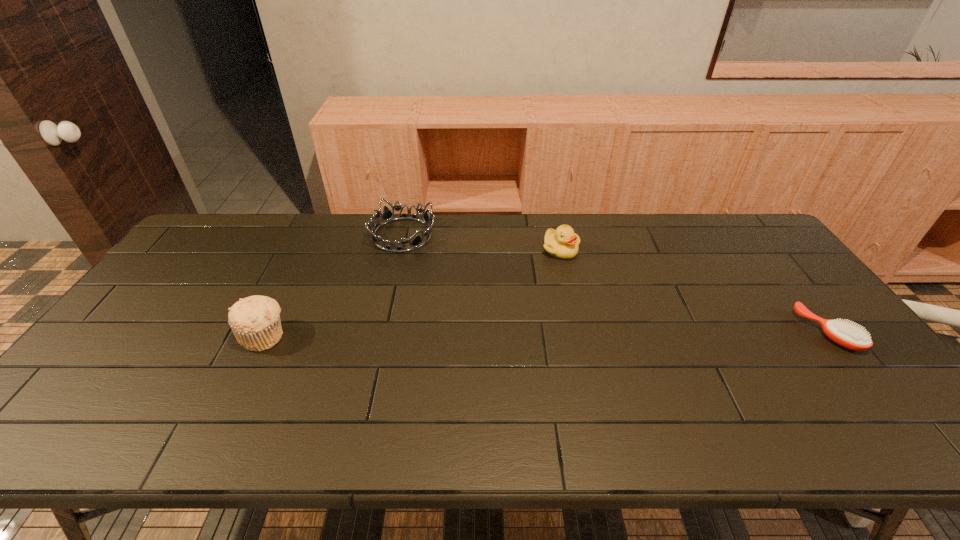
You are a GUI agent. You are given a task and a screenshot of the screen. Output one action in this format:
    pyautogui.click(x=<x>, y=<y>)
    Task: Click on the free spot on the desktop that is between the leftmost object and the rightmost object and is positioned on the front-facing side of the third object from right to left
    This screenshot has height=540, width=960.
    Given the screenshot: What is the action you would take?
    pyautogui.click(x=508, y=334)

Image resolution: width=960 pixels, height=540 pixels. I want to click on free space on the desktop that is between the tallest object and the rightmost object and is positioned on the beak of the second object from right to left, so click(583, 333).